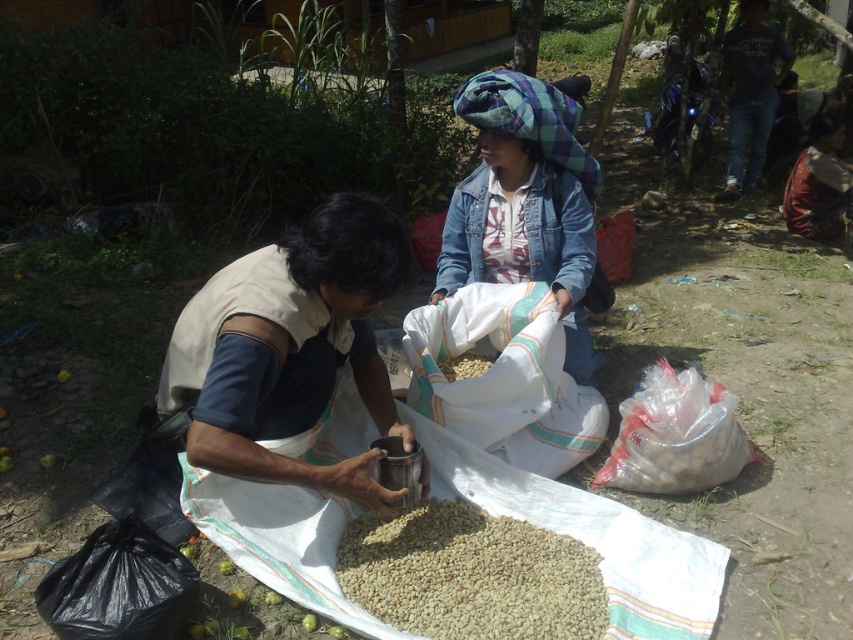
Question: Is light brown grain at center smaller than dark blue t-shirt at upper right?

Choices:
 (A) no
 (B) yes

Answer: (B)

Question: Does metallic cup at center come in front of denim jacket at center?

Choices:
 (A) no
 (B) yes

Answer: (B)

Question: Which point appears closest to the camera in this image?

Choices:
 (A) (505, 566)
 (B) (267, 259)
 (C) (537, 141)

Answer: (B)

Question: Among these points, which one is nearest to the camera?

Choices:
 (A) (515, 595)
 (B) (540, 186)
 (C) (724, 42)
 (D) (241, 448)

Answer: (D)

Question: Considering the relative positions of metallic cup at center and light brown grain at center in the image provided, where is metallic cup at center located with respect to light brown grain at center?

Choices:
 (A) right
 (B) left

Answer: (B)

Question: Which point is farther to the camera?

Choices:
 (A) (316, 472)
 (B) (483, 561)
 (C) (730, 141)
 (D) (473, 84)

Answer: (C)